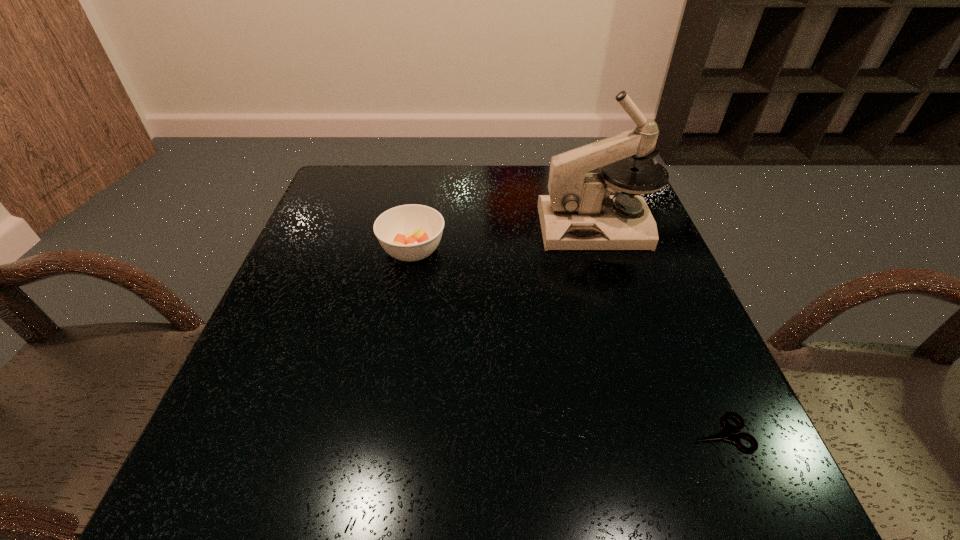
Locate an element on the screen. free space at the near left corner of the desktop is located at coordinates (245, 512).

In the image, there is a desktop. Where is `vacant region at the near right corner`? This screenshot has height=540, width=960. vacant region at the near right corner is located at coordinates (664, 472).

Find the location of a particular element. This screenshot has height=540, width=960. free space between the nearest object and the tallest object is located at coordinates (658, 330).

I want to click on unoccupied area between the tallest object and the nearest object, so click(658, 330).

Locate an element on the screen. The width and height of the screenshot is (960, 540). free space between the leftmost object and the shears is located at coordinates (566, 342).

This screenshot has width=960, height=540. I want to click on empty location between the soup bowl and the nearest object, so click(566, 342).

Locate an element on the screen. Image resolution: width=960 pixels, height=540 pixels. unoccupied area between the second tallest object and the tallest object is located at coordinates (504, 239).

Where is `vacant space in between the second shortest object and the microscope`? vacant space in between the second shortest object and the microscope is located at coordinates (504, 239).

Locate an element on the screen. This screenshot has width=960, height=540. free area in between the shortest object and the microscope is located at coordinates (658, 330).

I want to click on empty space that is in between the tallest object and the shortest object, so [658, 330].